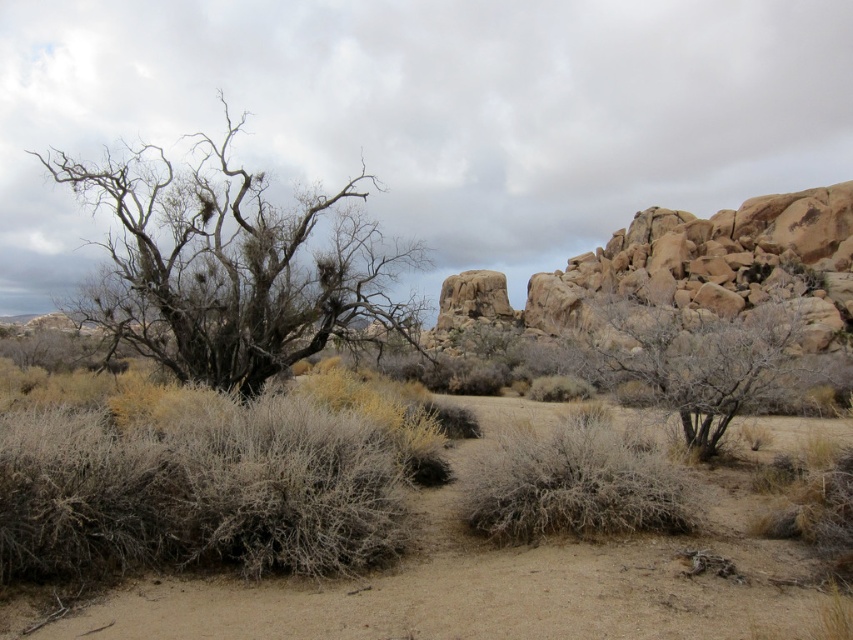
Between brown sandy soil at center and dead wood tree at left, which one has less height?

brown sandy soil at center

Is brown sandy soil at center shorter than dead wood tree at left?

Correct, brown sandy soil at center is not as tall as dead wood tree at left.

Who is more forward, (459, 618) or (303, 236)?

Positioned in front is point (459, 618).

Image resolution: width=853 pixels, height=640 pixels. I want to click on brown sandy soil at center, so pyautogui.click(x=502, y=588).

Is brown sandy soil at center in front of fuzzy gray bush at center?

Yes.

Is brown sandy soil at center further to the viewer compared to fuzzy gray bush at center?

No, brown sandy soil at center is in front of fuzzy gray bush at center.

Find the location of a particular element. brown sandy soil at center is located at coordinates (502, 588).

Identify the location of grayish-brown textured bush at lower left. (196, 490).

Who is taller, grayish-brown textured bush at lower left or dead wood tree at left?

Standing taller between the two is dead wood tree at left.

Locate an element on the screen. grayish-brown textured bush at lower left is located at coordinates (x=196, y=490).